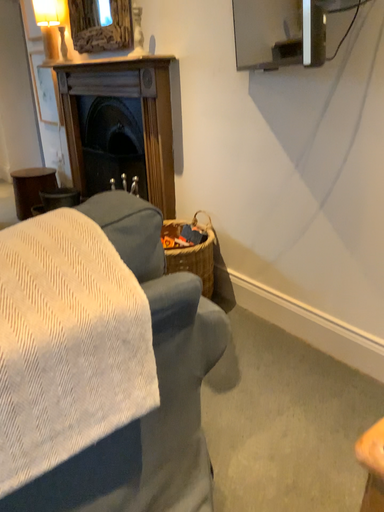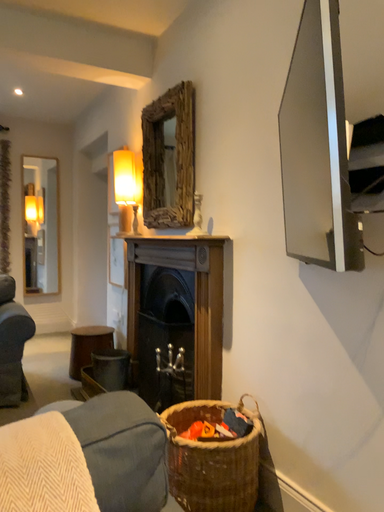
Question: Which way did the camera rotate in the video?

Choices:
 (A) rotated upward
 (B) rotated downward

Answer: (A)